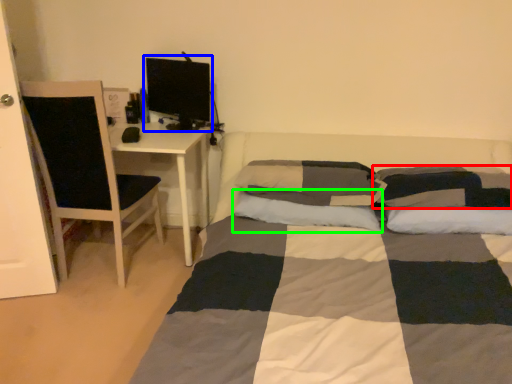
Question: Which is farther away from pillow (highlighted by a red box)? computer monitor (highlighted by a blue box) or pillow (highlighted by a green box)?

Choices:
 (A) computer monitor
 (B) pillow

Answer: (A)